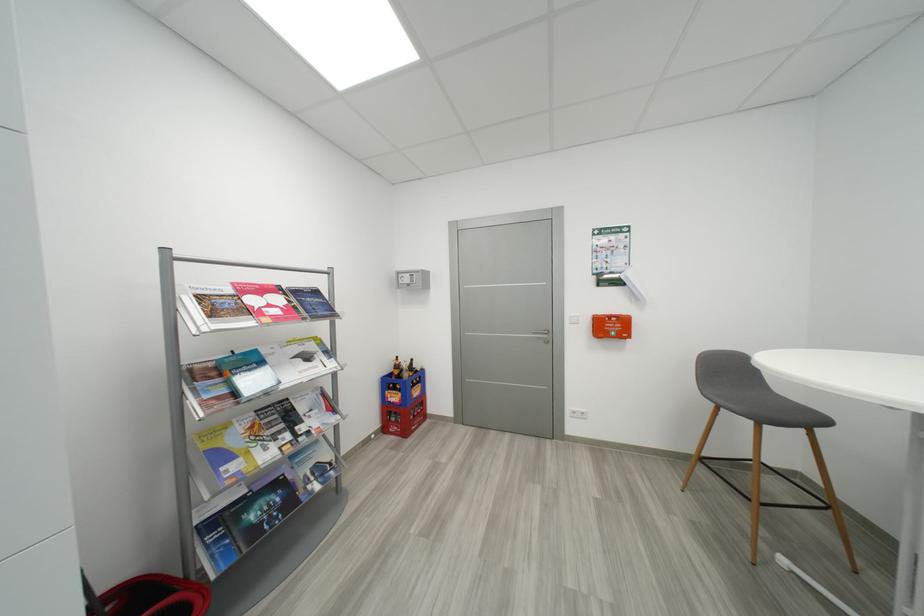
This screenshot has height=616, width=924. Find the location of `silver door handle`. silver door handle is located at coordinates (545, 334).